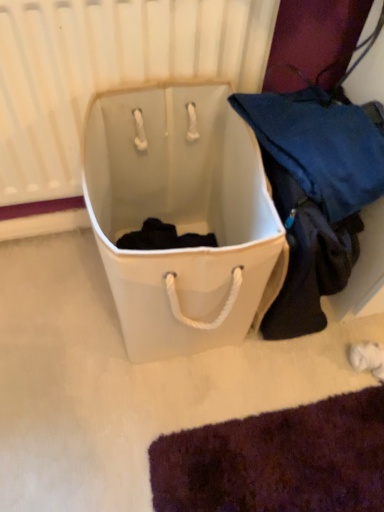
Question: Is white matte radiator at upper center bigger than white canvas laundry basket at center?

Choices:
 (A) yes
 (B) no

Answer: (B)

Question: From the image's perspective, is white matte radiator at upper center below white canvas laundry basket at center?

Choices:
 (A) yes
 (B) no

Answer: (B)

Question: Considering the relative positions of white matte radiator at upper center and white canvas laundry basket at center in the image provided, is white matte radiator at upper center to the left of white canvas laundry basket at center from the viewer's perspective?

Choices:
 (A) no
 (B) yes

Answer: (B)

Question: Can you confirm if white matte radiator at upper center is shorter than white canvas laundry basket at center?

Choices:
 (A) yes
 (B) no

Answer: (B)

Question: From the image's perspective, is white matte radiator at upper center above white canvas laundry basket at center?

Choices:
 (A) no
 (B) yes

Answer: (B)

Question: Is white matte radiator at upper center positioned far away from white canvas laundry basket at center?

Choices:
 (A) yes
 (B) no

Answer: (B)

Question: From the image's perspective, is white canvas laundry basket at center located above white matte radiator at upper center?

Choices:
 (A) no
 (B) yes

Answer: (A)

Question: Is white canvas laundry basket at center to the right of white matte radiator at upper center from the viewer's perspective?

Choices:
 (A) yes
 (B) no

Answer: (A)

Question: From a real-world perspective, is white canvas laundry basket at center below white matte radiator at upper center?

Choices:
 (A) yes
 (B) no

Answer: (A)

Question: Is white canvas laundry basket at center turned away from white matte radiator at upper center?

Choices:
 (A) yes
 (B) no

Answer: (A)

Question: Does white canvas laundry basket at center have a greater width compared to white matte radiator at upper center?

Choices:
 (A) yes
 (B) no

Answer: (A)

Question: From the image's perspective, would you say white canvas laundry basket at center is shown under white matte radiator at upper center?

Choices:
 (A) yes
 (B) no

Answer: (A)

Question: From a real-world perspective, is white matte radiator at upper center physically located above or below white canvas laundry basket at center?

Choices:
 (A) below
 (B) above

Answer: (B)